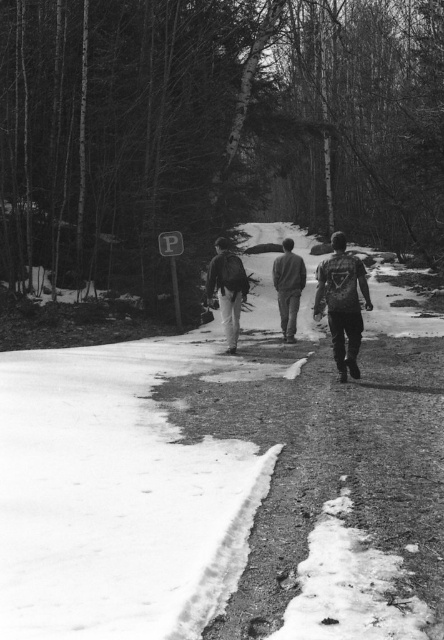
Who is higher up, matte black jacket at center or dark gray fabric jacket at center?

dark gray fabric jacket at center is above.

Is matte black jacket at center smaller than dark gray fabric jacket at center?

Yes.

Image resolution: width=444 pixels, height=640 pixels. Describe the element at coordinates (226, 289) in the screenshot. I see `matte black jacket at center` at that location.

You are a GUI agent. You are given a task and a screenshot of the screen. Output one action in this format:
    pyautogui.click(x=<x>, y=<y>)
    Task: Click on the matte black jacket at center
    
    Given the screenshot: What is the action you would take?
    pyautogui.click(x=226, y=289)

Measure the distance between dark gray fabric backpack at center and matte black jacket at center.

dark gray fabric backpack at center and matte black jacket at center are 3.34 meters apart.

Is the position of dark gray fabric backpack at center less distant than that of matte black jacket at center?

That is True.

Is point (325, 298) closer to viewer compared to point (225, 257)?

Yes, it is in front of point (225, 257).

The height and width of the screenshot is (640, 444). Identify the location of dark gray fabric backpack at center. (343, 304).

Is dark gray fabric backpack at center in front of dark gray fabric jacket at center?

Yes.

Is dark gray fabric backpack at center shorter than dark gray fabric jacket at center?

Yes, dark gray fabric backpack at center is shorter than dark gray fabric jacket at center.

Is point (341, 236) positioned behind point (297, 282)?

No, (341, 236) is in front of (297, 282).

Locate an element on the screen. This screenshot has height=640, width=444. dark gray fabric backpack at center is located at coordinates 343,304.